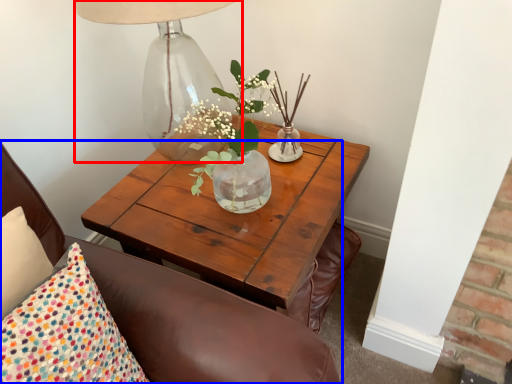
Question: Among these objects, which one is farthest to the camera, table lamp (highlighted by a red box) or chair (highlighted by a blue box)?

Choices:
 (A) table lamp
 (B) chair

Answer: (A)